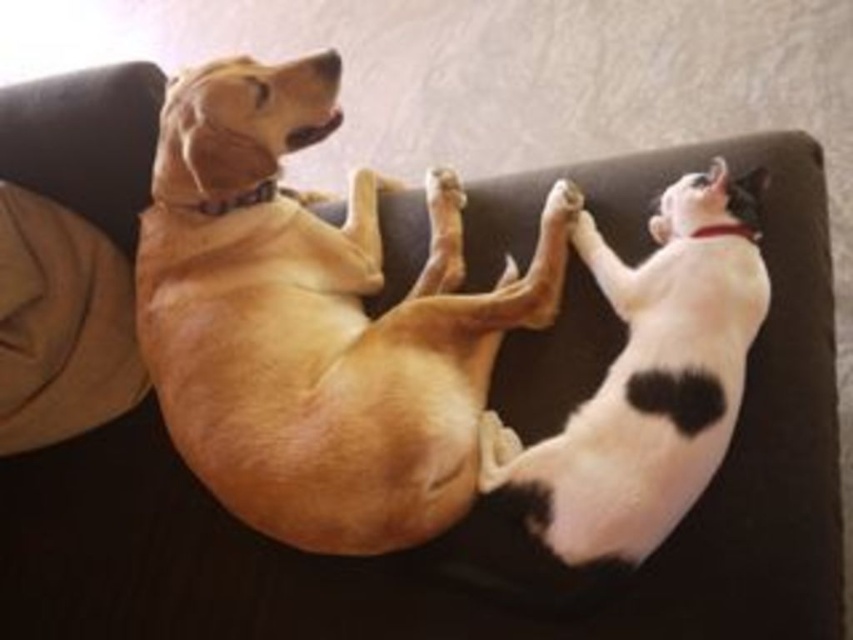
Can you confirm if white matte dog at center is positioned to the right of white fur paw at upper center?

Correct, you'll find white matte dog at center to the right of white fur paw at upper center.

Can you confirm if white matte dog at center is wider than white fur paw at upper center?

Correct, the width of white matte dog at center exceeds that of white fur paw at upper center.

Where is `white matte dog at center`? white matte dog at center is located at coordinates (648, 378).

Between white fur paw at center and white fur paw at upper center, which one has more height?

Standing taller between the two is white fur paw at center.

The image size is (853, 640). In order to click on white fur paw at center in this screenshot , I will do `click(444, 189)`.

This screenshot has width=853, height=640. What are the coordinates of `white fur paw at center` in the screenshot? It's located at coord(444,189).

Can you confirm if golden fur dog at center is thinner than white fur paw at upper center?

In fact, golden fur dog at center might be wider than white fur paw at upper center.

Where is `golden fur dog at center`? golden fur dog at center is located at coordinates (311, 323).

The height and width of the screenshot is (640, 853). What are the coordinates of `golden fur dog at center` in the screenshot? It's located at (311, 323).